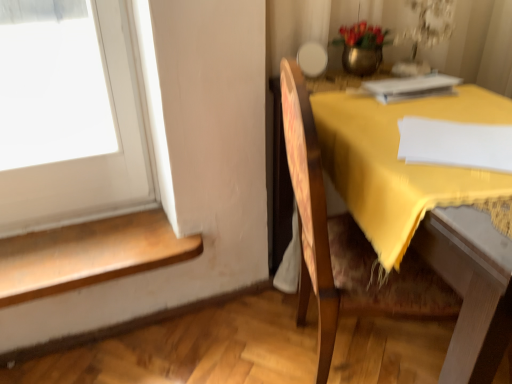
Find the location of a particular element. Image resolution: width=512 pixels, height=384 pixels. empty space that is to the right of white paper at upper right is located at coordinates (470, 96).